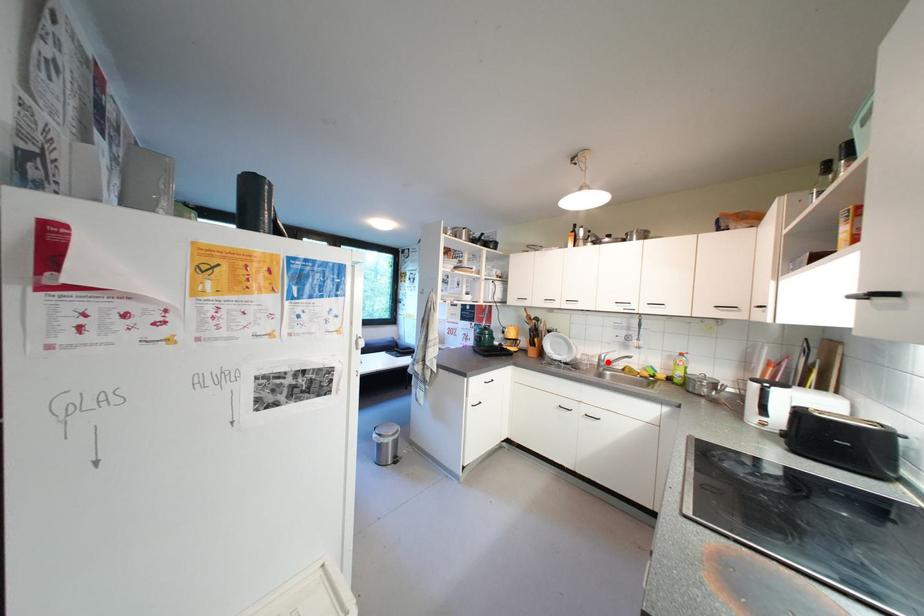
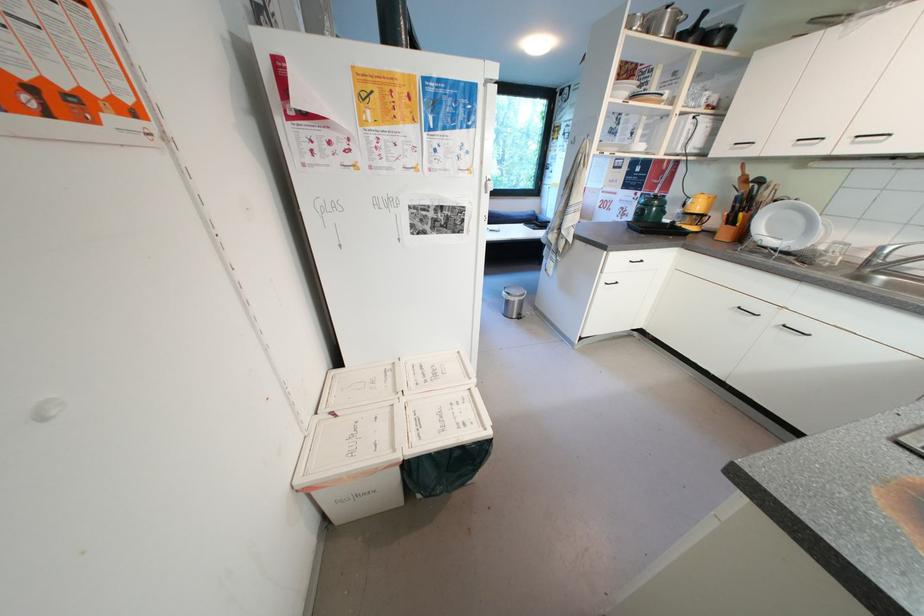
Find the pixel in the second image that matches the highlighted location in the first image.

(883, 257)